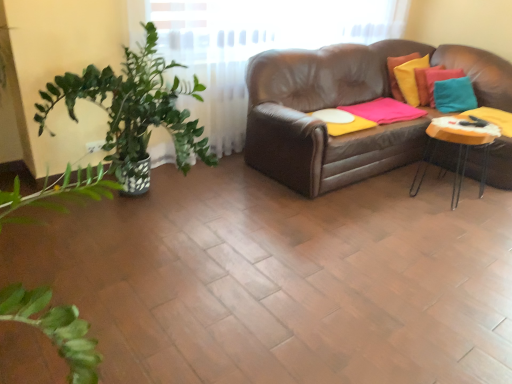
The image size is (512, 384). What do you see at coordinates (458, 147) in the screenshot? I see `yellow matte stool at right` at bounding box center [458, 147].

The height and width of the screenshot is (384, 512). I want to click on yellow matte stool at right, so click(x=458, y=147).

Where is `yellow matte stool at right`? This screenshot has height=384, width=512. yellow matte stool at right is located at coordinates (458, 147).